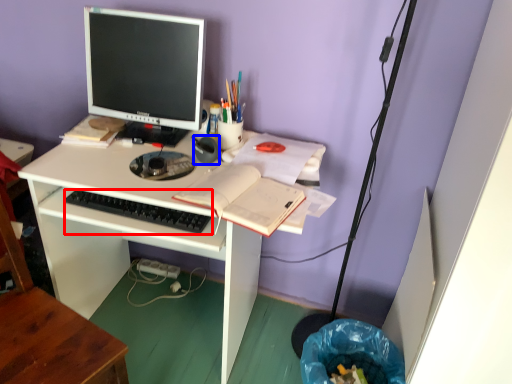
Question: Which of the following is the farthest to the observer, computer keyboard (highlighted by a red box) or stationery (highlighted by a blue box)?

Choices:
 (A) computer keyboard
 (B) stationery

Answer: (B)